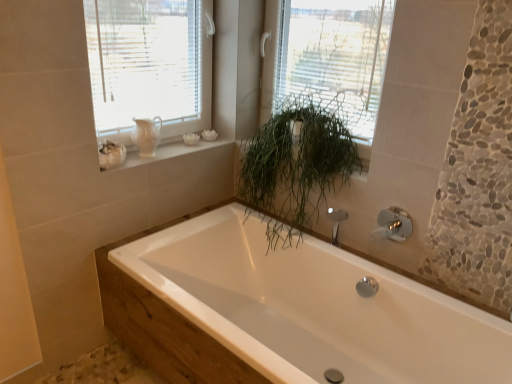
Question: Is chrome metallic faucet at upper right positioned beyond the bounds of matte white pitcher at upper left?

Choices:
 (A) no
 (B) yes

Answer: (B)

Question: Is chrome metallic faucet at upper right thinner than matte white pitcher at upper left?

Choices:
 (A) no
 (B) yes

Answer: (B)

Question: Can you confirm if chrome metallic faucet at upper right is taller than matte white pitcher at upper left?

Choices:
 (A) no
 (B) yes

Answer: (A)

Question: Is chrome metallic faucet at upper right further to the viewer compared to matte white pitcher at upper left?

Choices:
 (A) yes
 (B) no

Answer: (B)

Question: Can you confirm if chrome metallic faucet at upper right is wider than matte white pitcher at upper left?

Choices:
 (A) no
 (B) yes

Answer: (A)

Question: Considering the relative positions of chrome metallic faucet at upper right and matte white pitcher at upper left in the image provided, is chrome metallic faucet at upper right to the left of matte white pitcher at upper left from the viewer's perspective?

Choices:
 (A) no
 (B) yes

Answer: (A)

Question: Is white glossy bathtub at center closer to the viewer compared to white ceramic vase at upper left?

Choices:
 (A) yes
 (B) no

Answer: (A)

Question: Is white glossy bathtub at center oriented away from white ceramic vase at upper left?

Choices:
 (A) no
 (B) yes

Answer: (A)

Question: From a real-world perspective, is white glossy bathtub at center beneath white ceramic vase at upper left?

Choices:
 (A) no
 (B) yes

Answer: (B)

Question: Can you confirm if white glossy bathtub at center is smaller than white ceramic vase at upper left?

Choices:
 (A) yes
 (B) no

Answer: (B)

Question: Is white glossy bathtub at center further to the viewer compared to white ceramic vase at upper left?

Choices:
 (A) no
 (B) yes

Answer: (A)

Question: Does white glossy bathtub at center appear on the right side of white ceramic vase at upper left?

Choices:
 (A) yes
 (B) no

Answer: (A)

Question: Does green leafy plant at upper center have a greater width compared to white glossy bathtub at center?

Choices:
 (A) yes
 (B) no

Answer: (B)